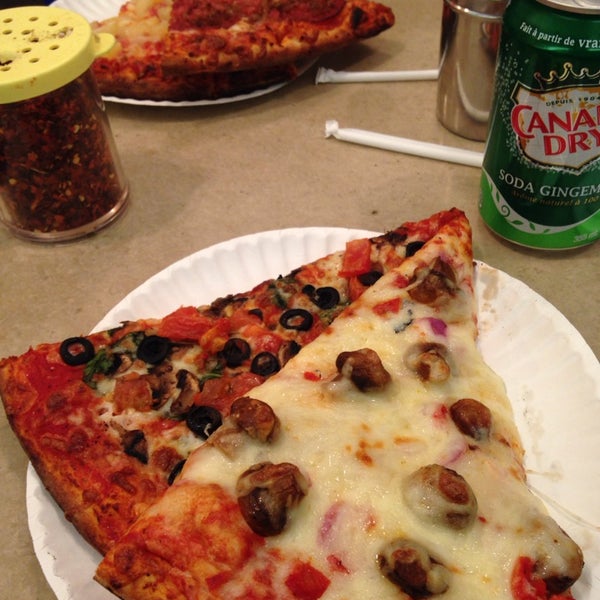
Locate an element on the screen. The image size is (600, 600). plate is located at coordinates (545, 394).